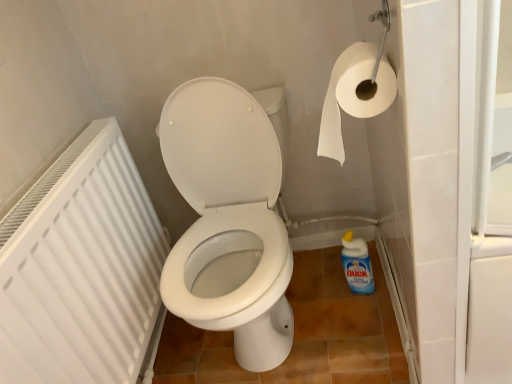
Question: Is white paper at upper right surrounded by blue glossy bottle at lower right?

Choices:
 (A) yes
 (B) no

Answer: (B)

Question: Can you confirm if blue glossy bottle at lower right is taller than white paper at upper right?

Choices:
 (A) yes
 (B) no

Answer: (A)

Question: From a real-world perspective, is blue glossy bottle at lower right on top of white paper at upper right?

Choices:
 (A) yes
 (B) no

Answer: (B)

Question: Is white paper at upper right at the back of blue glossy bottle at lower right?

Choices:
 (A) yes
 (B) no

Answer: (B)

Question: Does blue glossy bottle at lower right turn towards white paper at upper right?

Choices:
 (A) yes
 (B) no

Answer: (B)

Question: Does blue glossy bottle at lower right have a lesser width compared to white paper at upper right?

Choices:
 (A) yes
 (B) no

Answer: (A)

Question: From a real-world perspective, is white plastic radiator at left located higher than white paper at upper right?

Choices:
 (A) no
 (B) yes

Answer: (A)

Question: Does white plastic radiator at left have a greater width compared to white paper at upper right?

Choices:
 (A) no
 (B) yes

Answer: (A)

Question: From a real-world perspective, is white plastic radiator at left below white paper at upper right?

Choices:
 (A) no
 (B) yes

Answer: (B)

Question: From the image's perspective, is white plastic radiator at left beneath white paper at upper right?

Choices:
 (A) no
 (B) yes

Answer: (B)

Question: Can you confirm if white plastic radiator at left is bigger than white paper at upper right?

Choices:
 (A) yes
 (B) no

Answer: (A)

Question: Can you confirm if white plastic radiator at left is positioned to the right of white paper at upper right?

Choices:
 (A) no
 (B) yes

Answer: (A)

Question: Is white paper at upper right at the left side of white plastic radiator at left?

Choices:
 (A) yes
 (B) no

Answer: (B)